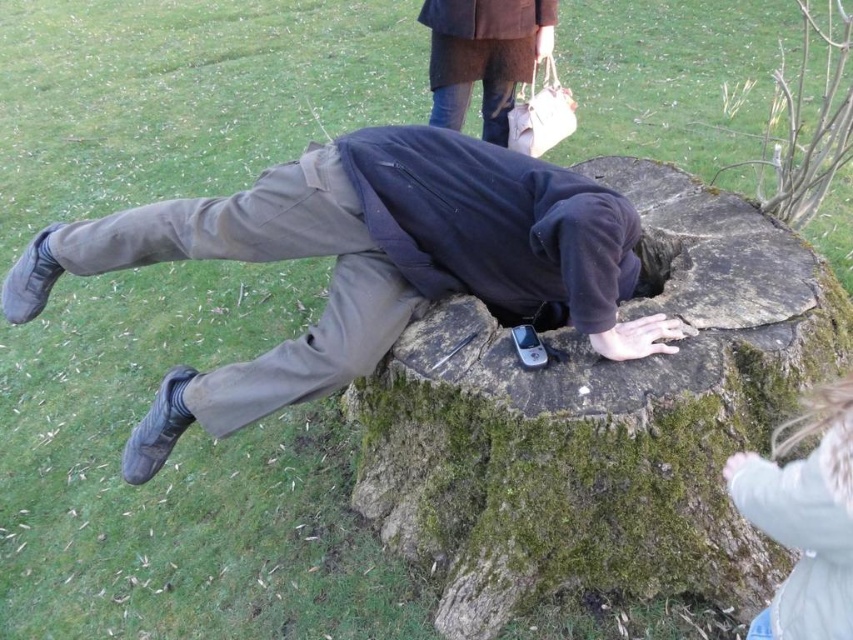
Looking at this image, you are a photographer trying to capture the scene where the person is falling into the tree stump. You need to place a prop, a dark blue fleece at center, exactly halfway between the person and the mobile phone. Is this possible given their current positions?

The person and the mobile phone are 2.00 meters apart. Placing the dark blue fleece at center exactly halfway between them would require it to be placed at 1.00 meter from each, so yes, it is possible to position the dark blue fleece at center halfway between the two.

You are a hiker who has just spotted a mossy tree stump in the center of the image. You want to place your GPS marker exactly at the center of this stump. Given the coordinates provided, can you confirm if the point you marked at coordinates point (601, 424) is indeed the center of the mossy bark stump at center?

Yes, the point (601, 424) marks the mossy bark stump at center, so it is indeed the center of the stump.